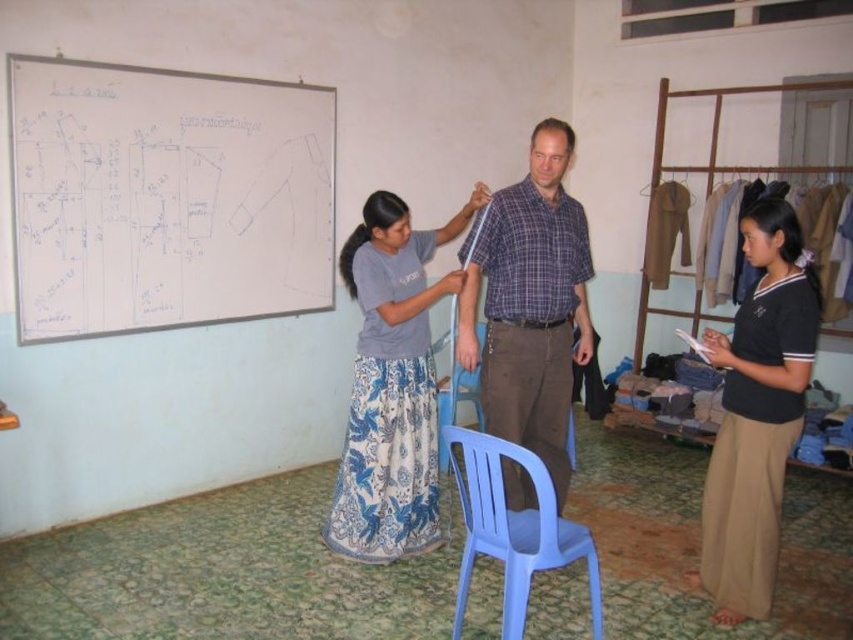
Consider the image. You are a tailor in the classroom and need to compare the widths of the white paperboard at upper left and the black cotton skirt at lower right. Which one is wider?

The white paperboard at upper left might be wider than black cotton skirt at lower right according to the description.